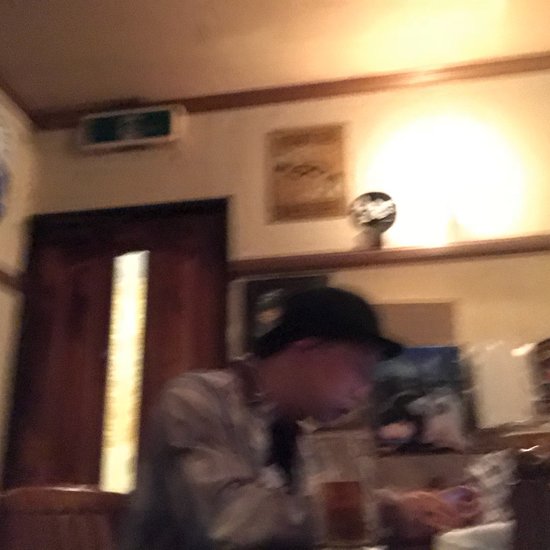
At what (x,y) coordinates should I click in order to perform the action: click on wood trim. Please return your answer as a coordinate pair (x, y). Looking at the image, I should click on (471, 257), (10, 276), (539, 434).